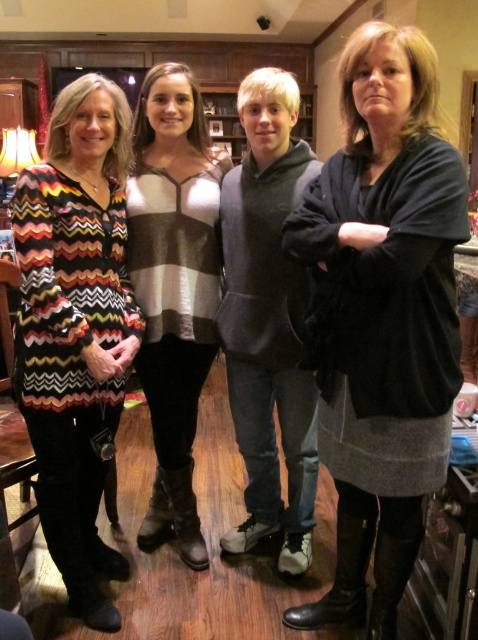
Question: Can you confirm if dark gray sweater at center is positioned above multicolored zigzag sweater at left?

Choices:
 (A) yes
 (B) no

Answer: (B)

Question: From the image, what is the correct spatial relationship of dark gray sweater at center in relation to striped sweater at center?

Choices:
 (A) left
 (B) right

Answer: (B)

Question: Among these objects, which one is farthest from the camera?

Choices:
 (A) gray fleece hoodie at center
 (B) dark gray sweater at center
 (C) striped sweater at center

Answer: (C)

Question: Is dark gray sweater at center to the left of multicolored zigzag sweater at left from the viewer's perspective?

Choices:
 (A) yes
 (B) no

Answer: (B)

Question: Which object is the closest to the striped sweater at center?

Choices:
 (A) dark gray sweater at center
 (B) gray fleece hoodie at center
 (C) multicolored zigzag sweater at left

Answer: (B)

Question: Which point appears farthest from the camera in this image?

Choices:
 (A) (139, 257)
 (B) (113, 218)

Answer: (A)